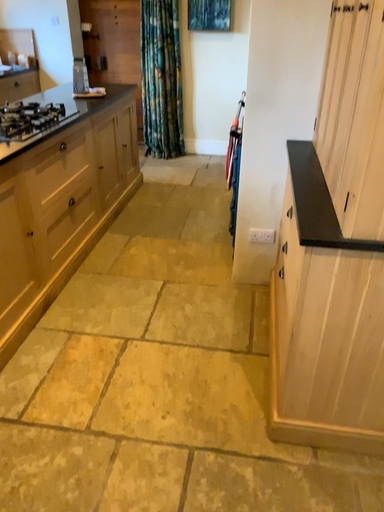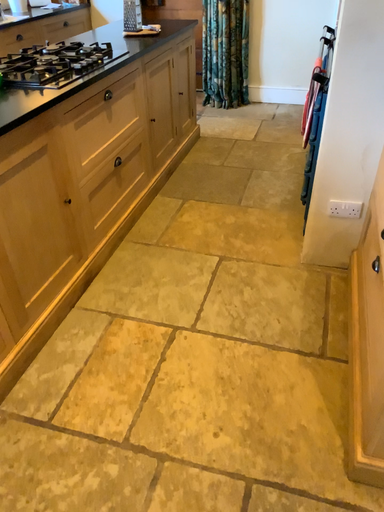
Question: Which way did the camera rotate in the video?

Choices:
 (A) rotated upward
 (B) rotated downward

Answer: (B)